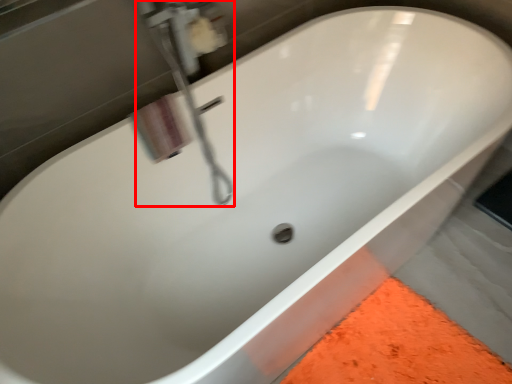
Question: From the image, what is the correct spatial relationship of plumbing fixture (annotated by the red box) in relation to plumbing fixture?

Choices:
 (A) right
 (B) left

Answer: (B)